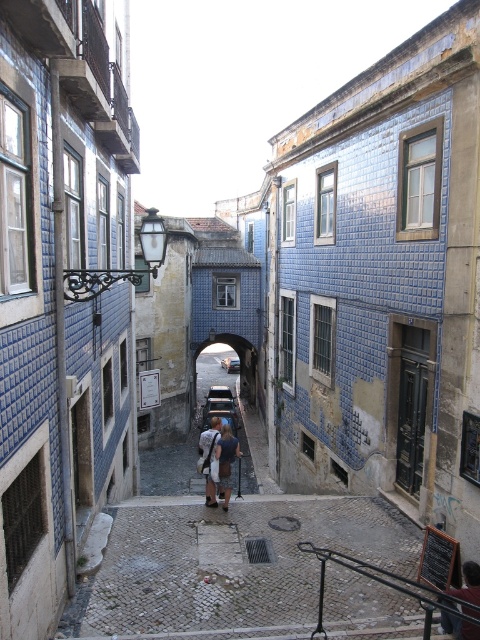
Can you confirm if dark blue jeans at center is positioned above metallic silver car at center?

Yes.

Which is in front, point (456, 593) or point (232, 371)?

Positioned in front is point (456, 593).

Does point (444, 600) come behind point (236, 371)?

No, (444, 600) is in front of (236, 371).

The width and height of the screenshot is (480, 640). I want to click on dark blue jeans at center, so click(468, 582).

From the picture: Can you confirm if denim jacket at center is shorter than metallic silver car at center?

In fact, denim jacket at center may be taller than metallic silver car at center.

Who is more forward, (225, 448) or (228, 368)?

Point (225, 448) is more forward.

Locate an element on the screen. This screenshot has width=480, height=640. denim jacket at center is located at coordinates (217, 460).

Which is in front, point (216, 472) or point (468, 561)?

Positioned in front is point (468, 561).

Is denim jacket at center below dark blue jeans at center?

Correct, denim jacket at center is located below dark blue jeans at center.

Between point (228, 436) and point (478, 611), which one is positioned in front?

Positioned in front is point (478, 611).

Find the location of `denim jacket at center`. denim jacket at center is located at coordinates (217, 460).